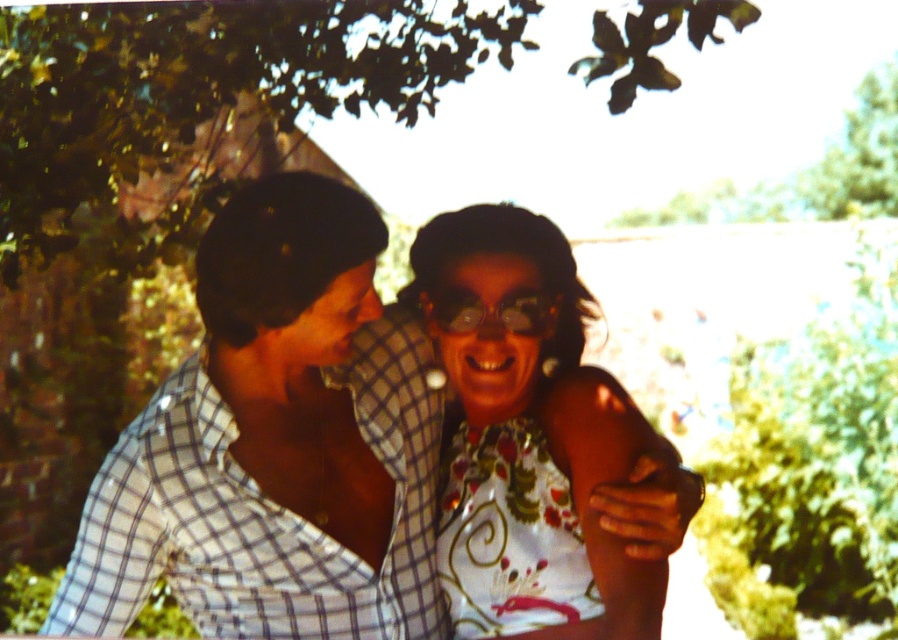
Does point (483, 502) come behind point (534, 326)?

Yes, point (483, 502) is farther from viewer.

In the scene shown: Who is more forward, (541, 272) or (481, 321)?

Point (541, 272) is in front.

Locate an element on the screen. This screenshot has width=898, height=640. white floral dress at center is located at coordinates (529, 436).

Is point (333, 304) in front of point (514, 307)?

Yes, it is in front of point (514, 307).

Can you confirm if white checkered shirt at center is thinner than transparent plastic goggles at center?

In fact, white checkered shirt at center might be wider than transparent plastic goggles at center.

Between point (271, 506) and point (496, 316), which one is positioned in front?

Point (271, 506) is more forward.

This screenshot has height=640, width=898. I want to click on white checkered shirt at center, so point(276,444).

Consider the image. Who is positioned more to the left, white floral dress at center or checkered fabric shirt at left?

checkered fabric shirt at left

Does white floral dress at center have a greater height compared to checkered fabric shirt at left?

Correct, white floral dress at center is much taller as checkered fabric shirt at left.

Which is in front, point (515, 296) or point (394, 384)?

Point (515, 296) is in front.

This screenshot has height=640, width=898. In order to click on white floral dress at center in this screenshot , I will do `click(529, 436)`.